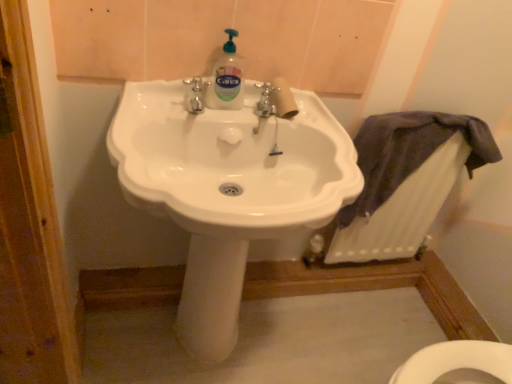
Question: Would you say white glossy sink at center is a long distance from translucent plastic bottle at center?

Choices:
 (A) no
 (B) yes

Answer: (A)

Question: Is white glossy sink at center wider than translucent plastic bottle at center?

Choices:
 (A) no
 (B) yes

Answer: (B)

Question: From a real-world perspective, is white glossy sink at center physically below translucent plastic bottle at center?

Choices:
 (A) yes
 (B) no

Answer: (A)

Question: Considering the relative sizes of white glossy sink at center and translucent plastic bottle at center in the image provided, is white glossy sink at center smaller than translucent plastic bottle at center?

Choices:
 (A) no
 (B) yes

Answer: (A)

Question: Is white glossy sink at center taller than translucent plastic bottle at center?

Choices:
 (A) no
 (B) yes

Answer: (B)

Question: From the image's perspective, would you say white glossy sink at center is positioned over translucent plastic bottle at center?

Choices:
 (A) yes
 (B) no

Answer: (B)

Question: From the image's perspective, is translucent plastic bottle at center on white textured radiator at lower right?

Choices:
 (A) yes
 (B) no

Answer: (A)

Question: Does translucent plastic bottle at center turn towards white textured radiator at lower right?

Choices:
 (A) yes
 (B) no

Answer: (B)

Question: Is translucent plastic bottle at center looking in the opposite direction of white textured radiator at lower right?

Choices:
 (A) no
 (B) yes

Answer: (A)

Question: Is translucent plastic bottle at center positioned far away from white textured radiator at lower right?

Choices:
 (A) yes
 (B) no

Answer: (B)

Question: Can you confirm if translucent plastic bottle at center is positioned to the right of white textured radiator at lower right?

Choices:
 (A) yes
 (B) no

Answer: (B)

Question: Is translucent plastic bottle at center not inside white textured radiator at lower right?

Choices:
 (A) no
 (B) yes

Answer: (B)

Question: From the image's perspective, does white textured radiator at lower right appear lower than white glossy sink at center?

Choices:
 (A) yes
 (B) no

Answer: (B)